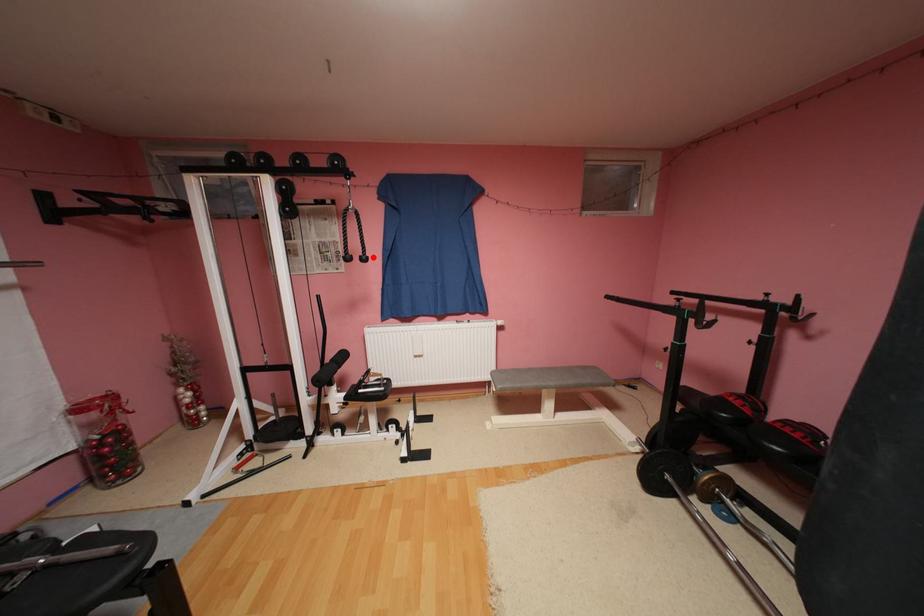
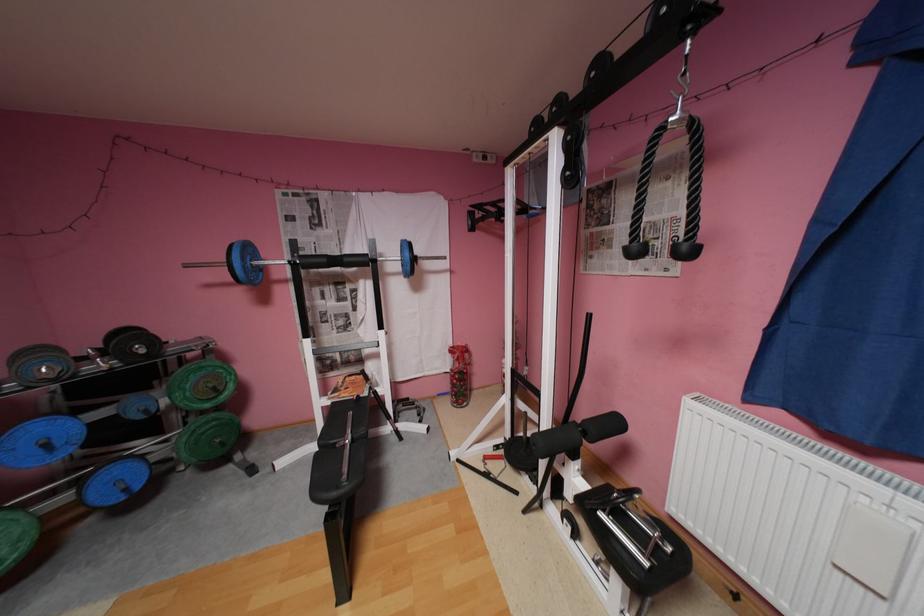
In the second image, find the point that corresponds to the highlighted location in the first image.

(695, 246)